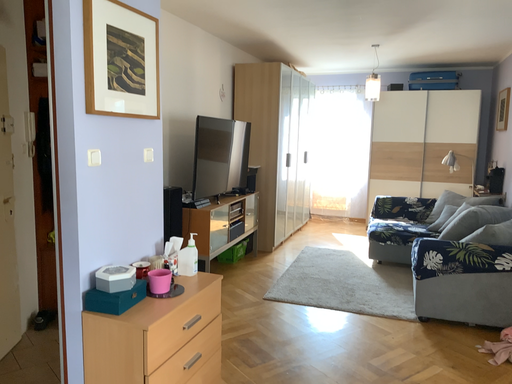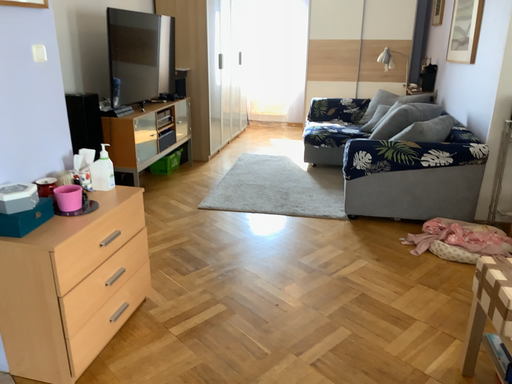
Question: How did the camera likely rotate when shooting the video?

Choices:
 (A) rotated upward
 (B) rotated downward

Answer: (B)